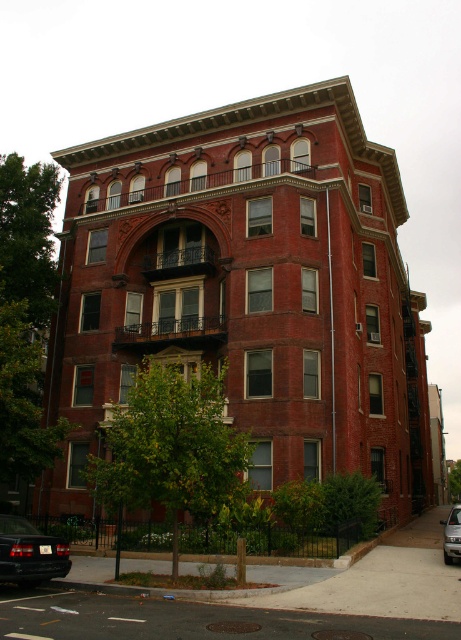
Question: Is matte black car at lower left below satin silver car at lower right?

Choices:
 (A) yes
 (B) no

Answer: (B)

Question: Which point is closer to the camera taking this photo?

Choices:
 (A) (450, 534)
 (B) (22, 536)

Answer: (B)

Question: Which of the following is the farthest from the observer?

Choices:
 (A) matte black car at lower left
 (B) satin silver car at lower right

Answer: (B)

Question: Does matte black car at lower left have a lesser width compared to satin silver car at lower right?

Choices:
 (A) yes
 (B) no

Answer: (A)

Question: Which object is closer to the camera taking this photo?

Choices:
 (A) satin silver car at lower right
 (B) matte black car at lower left

Answer: (B)

Question: Can you confirm if matte black car at lower left is thinner than satin silver car at lower right?

Choices:
 (A) yes
 (B) no

Answer: (A)